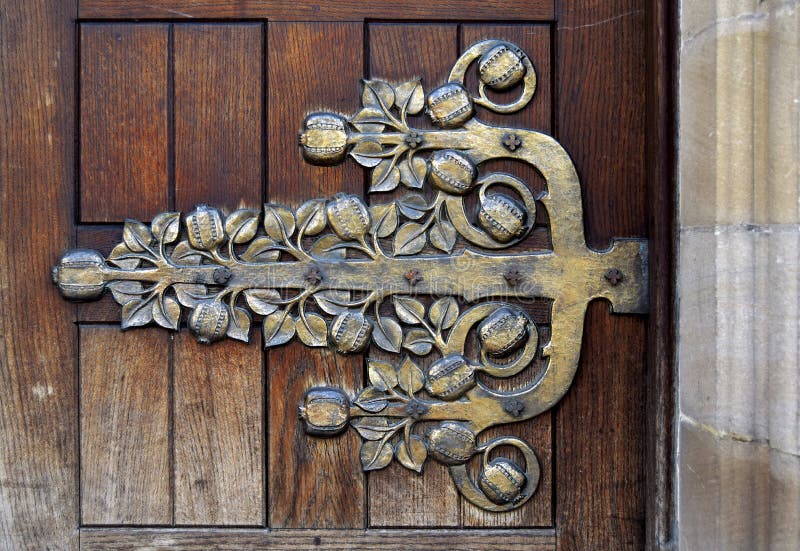
I want to click on brown door, so click(x=232, y=127).